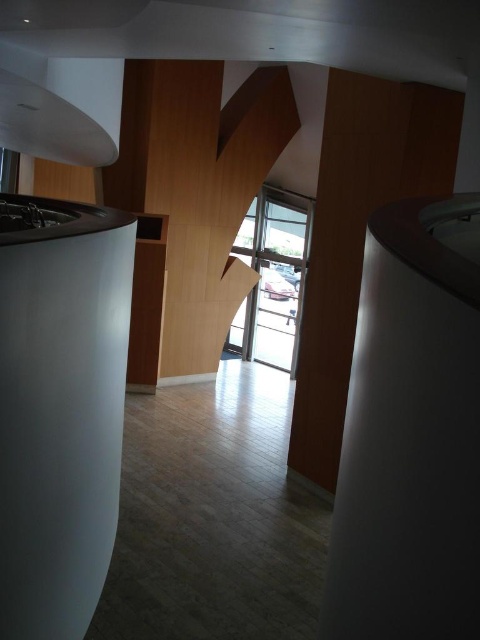
You are a visitor standing in the room and want to exit through the transparent glass door at center. To reach it, you must first walk around the white matte pillar at left. Which direction should you move relative to the pillar to approach the door?

Since the white matte pillar at left is below the transparent glass door at center, you should move to the right of the white matte pillar at left to approach the transparent glass door at center.

You are an interior designer planning to place a 1.2 meter wide sofa between the white matte pillar at left and the transparent glass door at center. Based on their widths, will the sofa fit in the space between them?

The white matte pillar at left has a lesser width compared to transparent glass door at center. Since the pillar is narrower, the total available space between them might accommodate the 1.2 meter sofa, but exact dimensions are needed for confirmation.